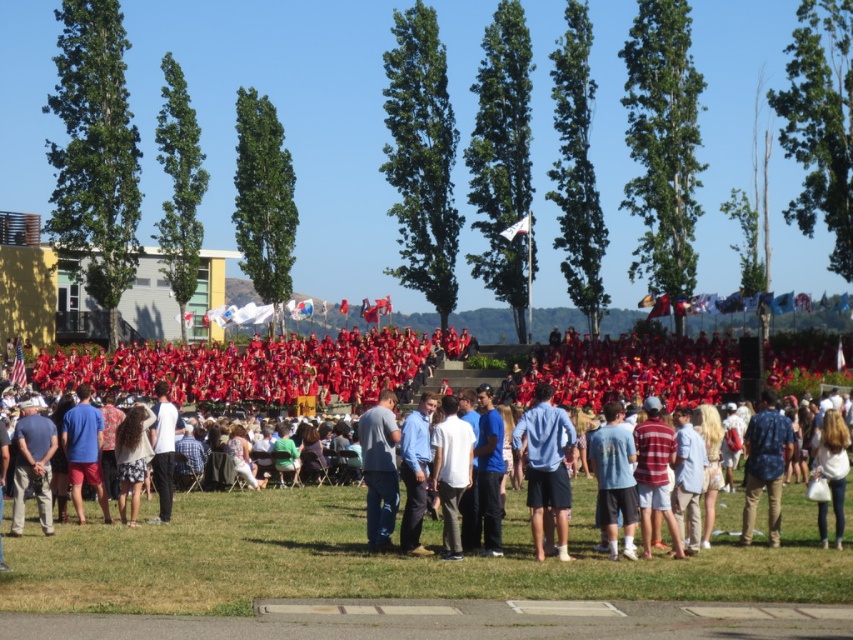
You are a photographer at the graduation ceremony. You need to capture a photo that includes both the light blue cotton shirt at center and the blue denim jeans at lower left. The camera you are using has a maximum zoom range that can focus on objects up to 15 meters away. Will you be able to include both subjects in the same frame without moving closer?

The distance between the light blue cotton shirt at center and the blue denim jeans at lower left is 17.34 meters, which exceeds the camera maximum zoom range of 15 meters. Therefore, you cannot include both subjects in the same frame without moving closer.

Consider the image. You are a photographer at the graduation ceremony. You need to capture a photo that includes both the blue jeans at center and denim shorts at lower left. Based on their positions, which object should appear higher in the photo?

The blue jeans at center should appear higher in the photo because it is positioned above the denim shorts at lower left.